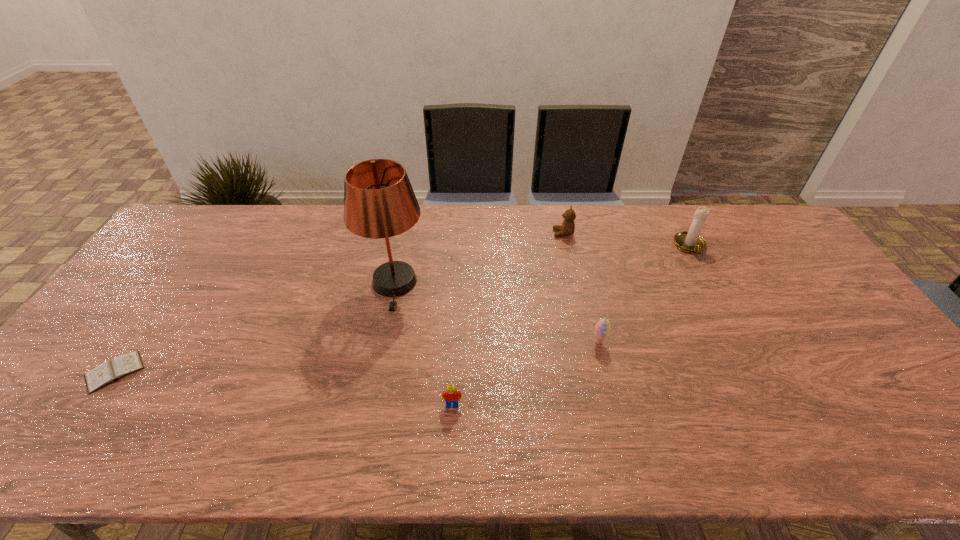
The height and width of the screenshot is (540, 960). Find the location of `the tallest object`. the tallest object is located at coordinates (379, 202).

Find the location of a particular element. The image size is (960, 540). lampshade is located at coordinates (379, 202).

Where is `candle holder`? The width and height of the screenshot is (960, 540). candle holder is located at coordinates (690, 241).

Where is `the rightmost object`? The image size is (960, 540). the rightmost object is located at coordinates (690, 241).

Find the location of a particular element. teddy bear is located at coordinates (567, 228).

Where is `the fourth farthest object`? The height and width of the screenshot is (540, 960). the fourth farthest object is located at coordinates (602, 327).

Where is `Lego`? Lego is located at coordinates (451, 395).

The height and width of the screenshot is (540, 960). What are the coordinates of `the third object from left to right` in the screenshot? It's located at (451, 395).

Locate an element on the screen. Image resolution: width=960 pixels, height=540 pixels. the shortest object is located at coordinates (110, 371).

I want to click on the leftmost object, so click(x=110, y=371).